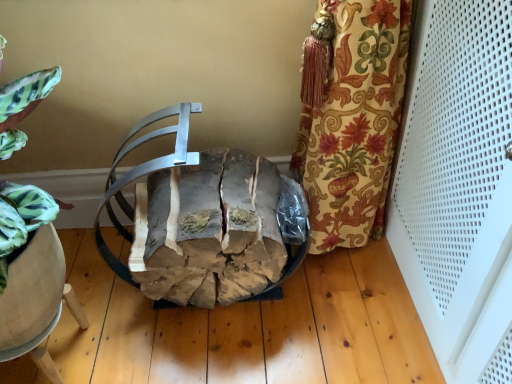
This screenshot has height=384, width=512. Describe the element at coordinates (38, 353) in the screenshot. I see `wooden chair at lower left` at that location.

At what (x,y) coordinates should I click in order to perform the action: click on wooden chair at lower left. Please return your answer as a coordinate pair (x, y). Image resolution: width=512 pixels, height=384 pixels. Looking at the image, I should click on (38, 353).

I want to click on rustic wood log at center, so click(x=201, y=221).

This screenshot has height=384, width=512. Describe the element at coordinates (201, 221) in the screenshot. I see `rustic wood log at center` at that location.

In order to face rustic wood log at center, should I rotate leftwards or rightwards?

Turn left by 5.094 degrees to look at rustic wood log at center.

Where is `wooden chair at lower left`? Image resolution: width=512 pixels, height=384 pixels. wooden chair at lower left is located at coordinates (38, 353).

In the image, is wooden chair at lower left on the left side or the right side of rustic wood log at center?

In the image, wooden chair at lower left appears on the left side of rustic wood log at center.

Between wooden chair at lower left and rustic wood log at center, which one is positioned behind?

wooden chair at lower left is further away from the camera.

Does point (41, 352) lie in front of point (264, 223)?

Yes, point (41, 352) is in front of point (264, 223).

From the image's perspective, would you say wooden chair at lower left is shown under rustic wood log at center?

Indeed, from the image's perspective, wooden chair at lower left is shown beneath rustic wood log at center.

From a real-world perspective, does wooden chair at lower left stand above rustic wood log at center?

No, from a real-world perspective, wooden chair at lower left is not on top of rustic wood log at center.

Can you confirm if wooden chair at lower left is thinner than rustic wood log at center?

Yes.

Who is shorter, wooden chair at lower left or rustic wood log at center?

With less height is wooden chair at lower left.

Based on their sizes in the image, would you say wooden chair at lower left is bigger or smaller than rustic wood log at center?

Clearly, wooden chair at lower left is smaller in size than rustic wood log at center.

Do you think wooden chair at lower left is within rustic wood log at center, or outside of it?

wooden chair at lower left lies outside rustic wood log at center.

Is wooden chair at lower left touching rustic wood log at center?

wooden chair at lower left and rustic wood log at center are clearly separated.

From the picture: Could you tell me if wooden chair at lower left is facing rustic wood log at center?

No, wooden chair at lower left is not turned towards rustic wood log at center.

How many degrees apart are the facing directions of wooden chair at lower left and rustic wood log at center?

The facing directions of wooden chair at lower left and rustic wood log at center are 1.49 degrees apart.

How far apart are wooden chair at lower left and rustic wood log at center?

wooden chair at lower left and rustic wood log at center are 14.93 inches apart.

This screenshot has width=512, height=384. Identify the location of furniture that appears below the rustic wood log at center (from the image's perspective). (38, 353).

Considering the positions of objects rustic wood log at center and wooden chair at lower left in the image provided, who is more to the right, rustic wood log at center or wooden chair at lower left?

rustic wood log at center.

Which object is closer to the camera taking this photo, rustic wood log at center or wooden chair at lower left?

rustic wood log at center.

Between point (259, 253) and point (69, 293), which one is positioned behind?

The point (69, 293) is more distant.

From the image's perspective, which object appears higher, rustic wood log at center or wooden chair at lower left?

rustic wood log at center is shown above in the image.

From a real-world perspective, who is located lower, rustic wood log at center or wooden chair at lower left?

From a 3D spatial view, wooden chair at lower left is below.

Does rustic wood log at center have a lesser width compared to wooden chair at lower left?

Incorrect, the width of rustic wood log at center is not less than that of wooden chair at lower left.

From their relative heights in the image, would you say rustic wood log at center is taller or shorter than wooden chair at lower left?

rustic wood log at center is taller than wooden chair at lower left.

Considering the relative sizes of rustic wood log at center and wooden chair at lower left in the image provided, is rustic wood log at center smaller than wooden chair at lower left?

Actually, rustic wood log at center might be larger than wooden chair at lower left.

Is wooden chair at lower left a part of rustic wood log at center?

Actually, wooden chair at lower left is outside rustic wood log at center.

Are rustic wood log at center and wooden chair at lower left beside each other?

They are not placed beside each other.

Is rustic wood log at center oriented towards wooden chair at lower left?

No, rustic wood log at center is not oriented towards wooden chair at lower left.

What's the angular difference between rustic wood log at center and wooden chair at lower left's facing directions?

1.49 degrees.

You are a GUI agent. You are given a task and a screenshot of the screen. Output one action in this format:
    pyautogui.click(x=<x>, y=<y>)
    Task: Click on the chair that is above the wooden chair at lower left (from the image's perspective)
    This screenshot has width=512, height=384.
    Given the screenshot: What is the action you would take?
    201,221

You are a GUI agent. You are given a task and a screenshot of the screen. Output one action in this format:
    pyautogui.click(x=<x>, y=<y>)
    Task: Click on the chair that appears above the wooden chair at lower left (from a real-world perspective)
    
    Given the screenshot: What is the action you would take?
    pyautogui.click(x=201, y=221)

At what (x,y) coordinates should I click in order to perform the action: click on chair that is above the wooden chair at lower left (from the image's perspective). Please return your answer as a coordinate pair (x, y). The image size is (512, 384). Looking at the image, I should click on (201, 221).